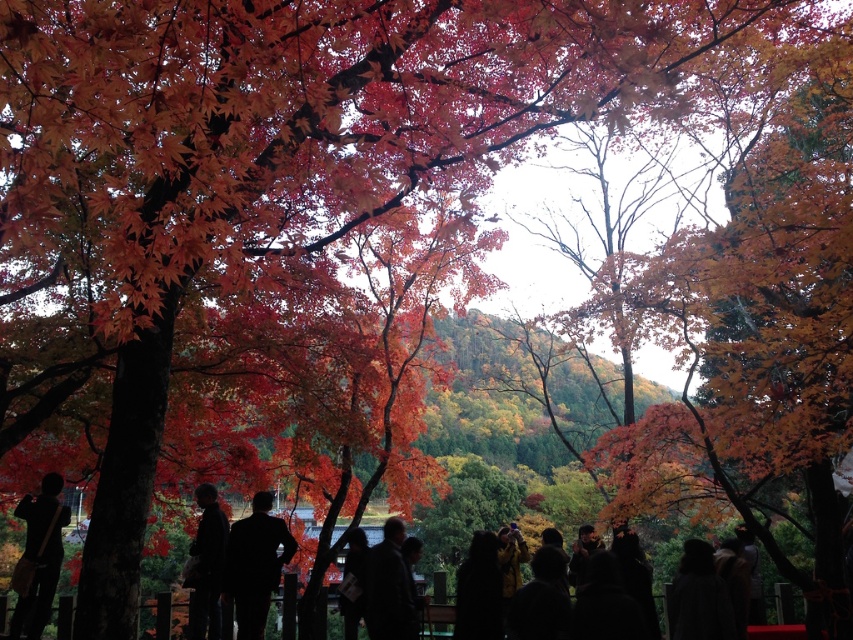
Is silhouette fabric bag at lower left behind dark fabric jacket at center?

No.

Between silhouette fabric bag at lower left and dark fabric jacket at center, which one has more height?

Standing taller between the two is dark fabric jacket at center.

Who is more distant from viewer, (51, 579) or (201, 609)?

Positioned behind is point (201, 609).

Identify the location of silhouette fabric bag at lower left. The height and width of the screenshot is (640, 853). (39, 554).

Between black fabric at center and silhouette fabric bag at lower left, which one appears on the right side from the viewer's perspective?

black fabric at center is more to the right.

Is black fabric at center behind silhouette fabric bag at lower left?

Yes, it is.

Is point (230, 589) positioned after point (19, 593)?

Yes, point (230, 589) is farther from viewer.

The width and height of the screenshot is (853, 640). I want to click on black fabric at center, so click(x=254, y=564).

Does dark gray coat at center have a lesser height compared to dark fabric jacket at center?

Indeed, dark gray coat at center has a lesser height compared to dark fabric jacket at center.

The image size is (853, 640). I want to click on dark gray coat at center, so click(x=389, y=588).